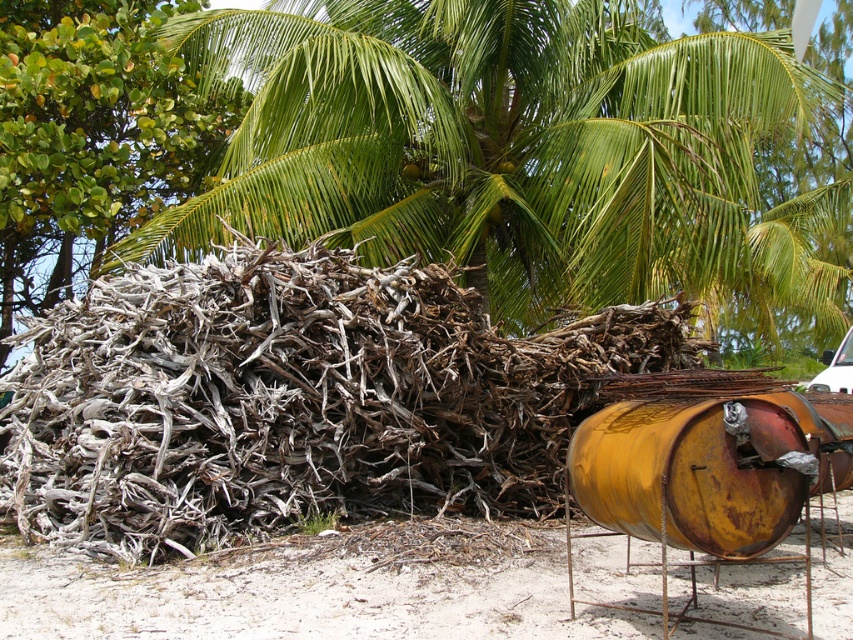
Based on the photo, is white driftwood at center shorter than white sand at lower left?

No.

Is white driftwood at center taller than white sand at lower left?

Correct, white driftwood at center is much taller as white sand at lower left.

Who is more forward, (515, 394) or (554, 632)?

Positioned in front is point (554, 632).

Identify the location of white driftwood at center. This screenshot has width=853, height=640. (293, 400).

Measure the distance between green leafy coconut tree at upper center and gray driftwood at left.

3.40 meters

Between point (410, 61) and point (78, 248), which one is positioned behind?

The point (78, 248) is behind.

Locate an element on the screen. The width and height of the screenshot is (853, 640). green leafy coconut tree at upper center is located at coordinates (515, 150).

Does green leafy coconut tree at upper center appear under rusty metallic barrel at right?

No.

Which is above, green leafy coconut tree at upper center or rusty metallic barrel at right?

green leafy coconut tree at upper center is above.

Locate an element on the screen. Image resolution: width=853 pixels, height=640 pixels. green leafy coconut tree at upper center is located at coordinates (515, 150).